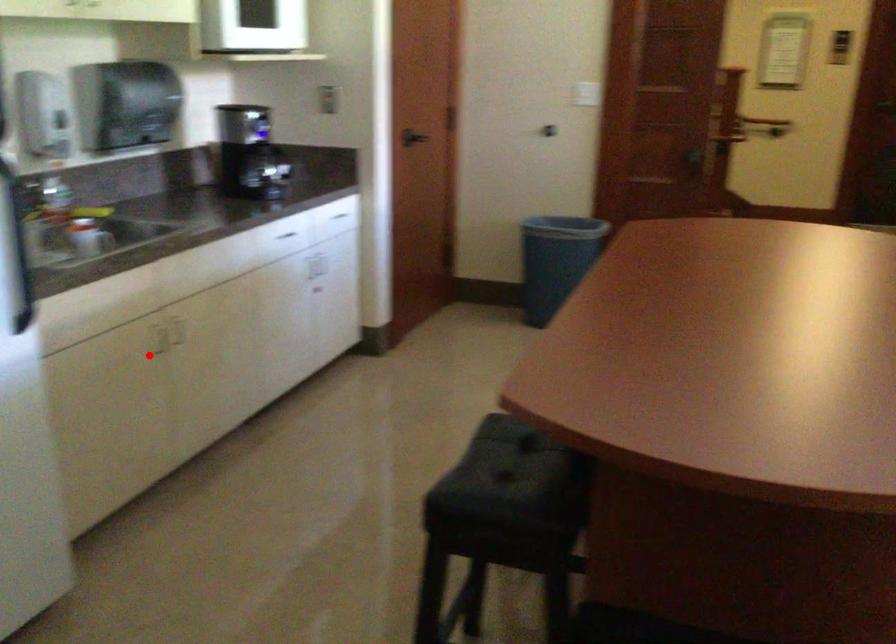
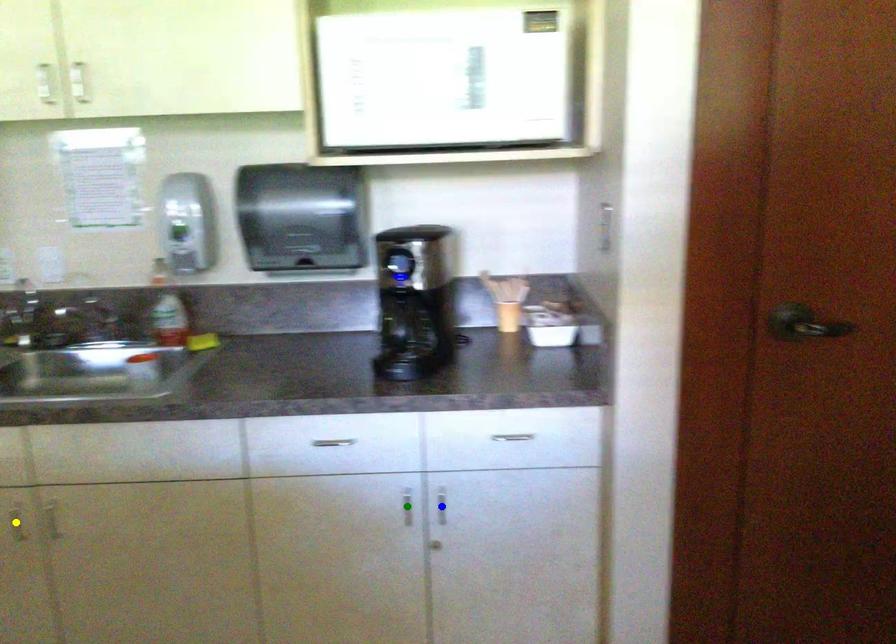
Question: I am providing you with two images of the same scene from different viewpoints. A red point is marked on the first image. You are given multiple points on the second image. Which point in image 2 is actually the same real-world point as the red point in image 1?

Choices:
 (A) blue point
 (B) yellow point
 (C) green point

Answer: (B)